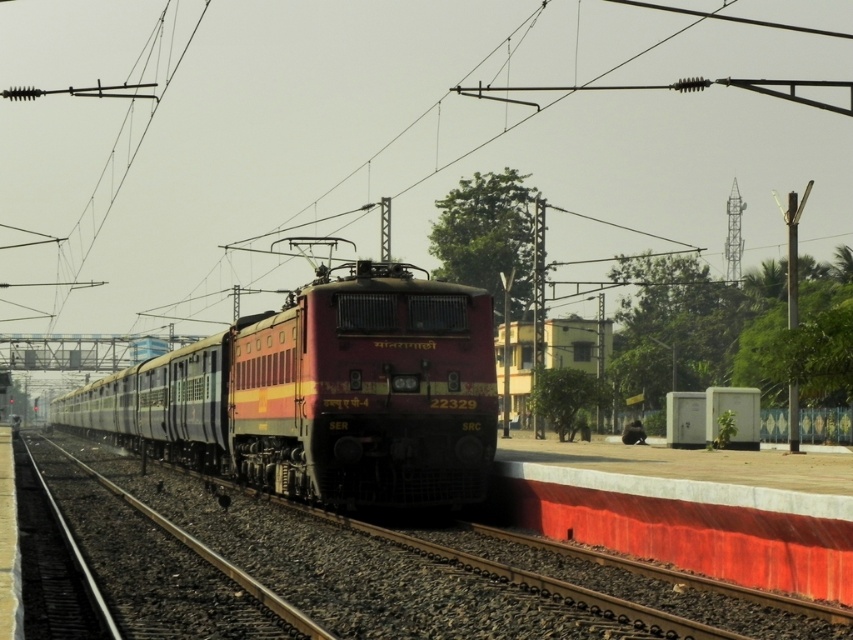
Question: Which of the following is the closest to the observer?

Choices:
 (A) (405, 484)
 (B) (421, 580)

Answer: (B)

Question: Which point is farther from the camera taking this photo?

Choices:
 (A) (109, 561)
 (B) (381, 307)

Answer: (B)

Question: Is matte red locomotive at center thinner than smooth metal train track at center?

Choices:
 (A) yes
 (B) no

Answer: (B)

Question: Can you confirm if matte red locomotive at center is positioned to the left of smooth metal train track at center?

Choices:
 (A) no
 (B) yes

Answer: (B)

Question: Does matte red locomotive at center have a greater width compared to smooth metal train track at center?

Choices:
 (A) yes
 (B) no

Answer: (A)

Question: Which point appears closest to the camera in this image?

Choices:
 (A) (360, 320)
 (B) (119, 464)

Answer: (A)